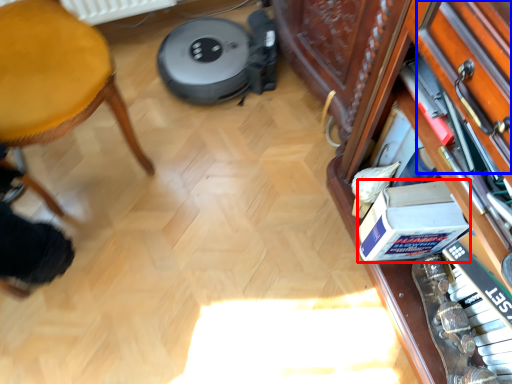
Question: Which of the following is the farthest to the observer, box (highlighted by a red box) or drawer (highlighted by a blue box)?

Choices:
 (A) box
 (B) drawer

Answer: (A)